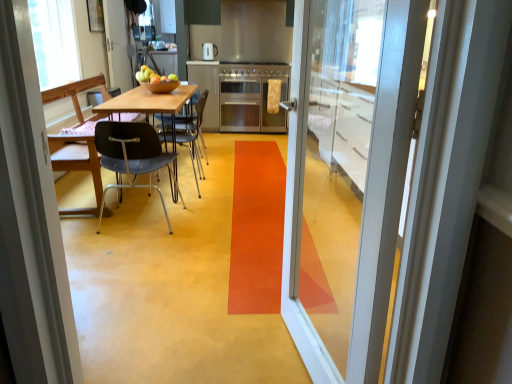
Question: Would you say matte silver kettle at center is part of stainless steel stove at center's contents?

Choices:
 (A) yes
 (B) no

Answer: (B)

Question: Considering the relative sizes of stainless steel stove at center and matte silver kettle at center in the image provided, is stainless steel stove at center taller than matte silver kettle at center?

Choices:
 (A) no
 (B) yes

Answer: (A)

Question: Is stainless steel stove at center far from matte silver kettle at center?

Choices:
 (A) yes
 (B) no

Answer: (B)

Question: Is stainless steel stove at center looking in the opposite direction of matte silver kettle at center?

Choices:
 (A) yes
 (B) no

Answer: (B)

Question: Is stainless steel stove at center bigger than matte silver kettle at center?

Choices:
 (A) yes
 (B) no

Answer: (A)

Question: Is transparent glass door at center, the 2th door positioned from the back, wider or thinner than satin silver refrigerator at center?

Choices:
 (A) thin
 (B) wide

Answer: (A)

Question: Is transparent glass door at center, positioned as the second door in left-to-right order, spatially inside satin silver refrigerator at center, or outside of it?

Choices:
 (A) inside
 (B) outside

Answer: (B)

Question: Looking at the image, does transparent glass door at center, which is the first door from right to left, seem bigger or smaller compared to satin silver refrigerator at center?

Choices:
 (A) small
 (B) big

Answer: (A)

Question: From a real-world perspective, relative to satin silver refrigerator at center, is transparent glass door at center, which appears as the 1th door when ordered from the bottom, vertically above or below?

Choices:
 (A) above
 (B) below

Answer: (A)

Question: Looking at the image, does white glossy door at upper left, the second door positioned from the front, seem bigger or smaller compared to metallic blue chair at left, placed as the first chair when sorted from left to right?

Choices:
 (A) small
 (B) big

Answer: (A)

Question: From a real-world perspective, is white glossy door at upper left, which is counted as the 1th door, starting from the top, above or below metallic blue chair at left, placed as the first chair when sorted from left to right?

Choices:
 (A) above
 (B) below

Answer: (A)

Question: Does point (122, 19) appear closer or farther from the camera than point (77, 165)?

Choices:
 (A) farther
 (B) closer

Answer: (A)

Question: Is white glossy door at upper left, which is counted as the 1th door, starting from the left, taller or shorter than metallic blue chair at left, placed as the first chair when sorted from left to right?

Choices:
 (A) short
 (B) tall

Answer: (B)

Question: From the image's perspective, is satin silver refrigerator at center positioned above or below wooden table at center?

Choices:
 (A) above
 (B) below

Answer: (A)

Question: In terms of width, does satin silver refrigerator at center look wider or thinner when compared to wooden table at center?

Choices:
 (A) thin
 (B) wide

Answer: (B)